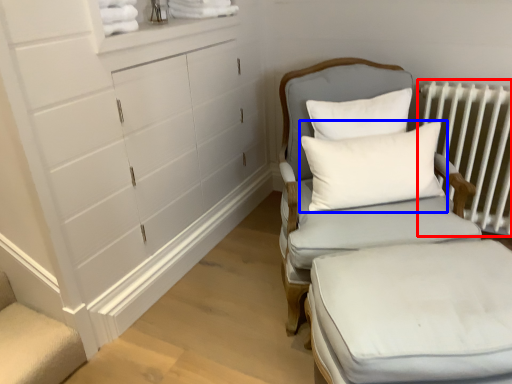
Question: Which point is further to the camera, radiator (highlighted by a red box) or pillow (highlighted by a blue box)?

Choices:
 (A) radiator
 (B) pillow

Answer: (A)